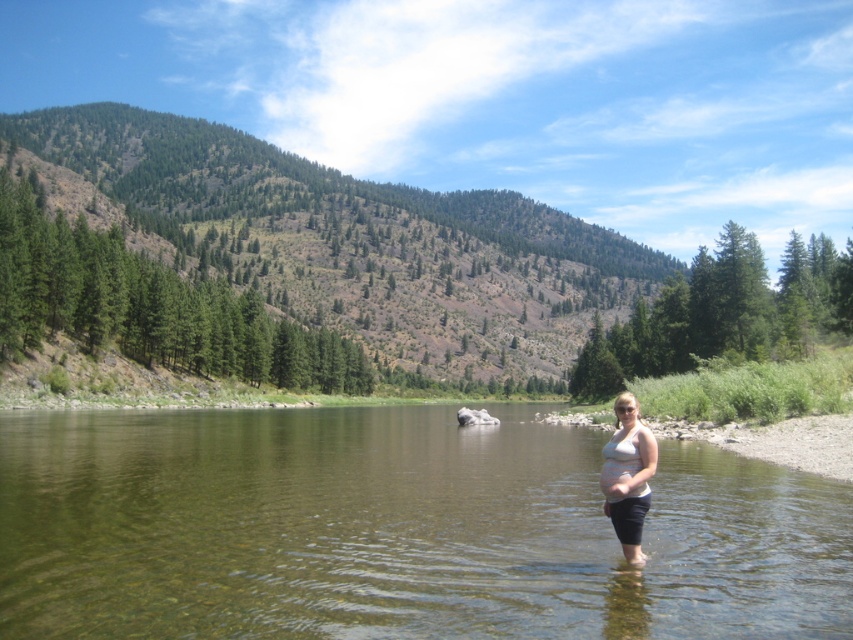
You are standing on the riverbank and see the clear water at center and the white matte tank top at center. Which object is positioned more to the left?

The clear water at center is positioned to the left of the white matte tank top at center.

You are a swimmer who wants to cross the river. You see the clear water at center and the matte skin belly at center. Which area should you avoid stepping on to prevent slipping?

You should avoid stepping on the matte skin belly at center because it has a non slippery surface compared to the clear water at center which might be wider and slippery.

You are a photographer aiming to capture the reflection of the clear water at center in your shot. Since the matte skin belly at center is blocking the view, can you shift your position to the right to get a better reflection?

The clear water at center is to the left of the matte skin belly at center. By moving to the right, you can position yourself so that the matte skin belly at center no longer obstructs the view of the clear water at center, allowing you to capture its reflection.